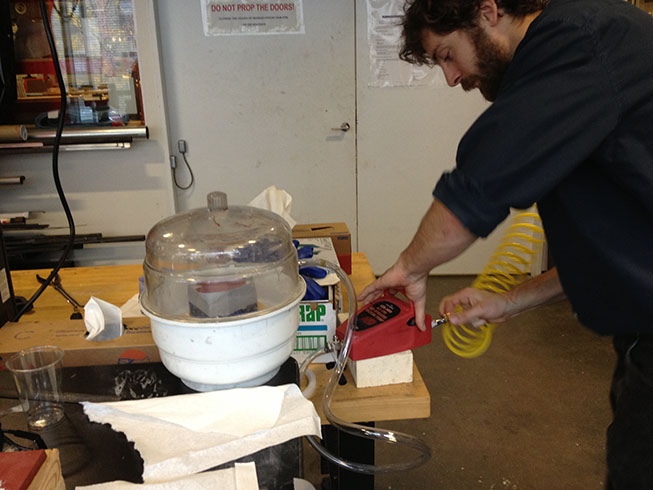
You are a GUI agent. You are given a task and a screenshot of the screen. Output one action in this format:
    pyautogui.click(x=<x>, y=<y>)
    Task: Click on the handle of door
    
    Given the screenshot: What is the action you would take?
    pyautogui.click(x=334, y=128)